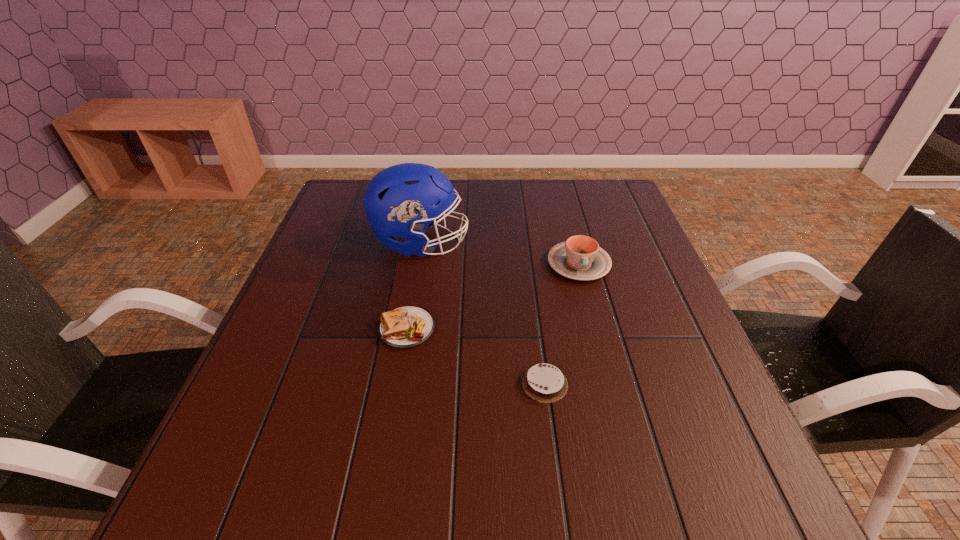
Locate which object ranks second in proximity to the football helmet. Please provide its 2D coordinates. Your answer should be formatted as a tuple, i.e. [(x, y)], where the tuple contains the x and y coordinates of a point satisfying the conditions above.

[(580, 258)]

What are the coordinates of `free point that satisfies the following two spatial constraints: 1. on the front-facing side of the tallest object; 2. on the left side of the shortest object` in the screenshot? It's located at (396, 383).

Where is `vacant space that satisfies the following two spatial constraints: 1. on the front-facing side of the tallest object; 2. on the right side of the second object from right to left`? This screenshot has height=540, width=960. vacant space that satisfies the following two spatial constraints: 1. on the front-facing side of the tallest object; 2. on the right side of the second object from right to left is located at coordinates (396, 383).

Where is `vacant point that satisfies the following two spatial constraints: 1. on the front-facing side of the sandwich; 2. on the right side of the tallest object`? Image resolution: width=960 pixels, height=540 pixels. vacant point that satisfies the following two spatial constraints: 1. on the front-facing side of the sandwich; 2. on the right side of the tallest object is located at coordinates click(406, 329).